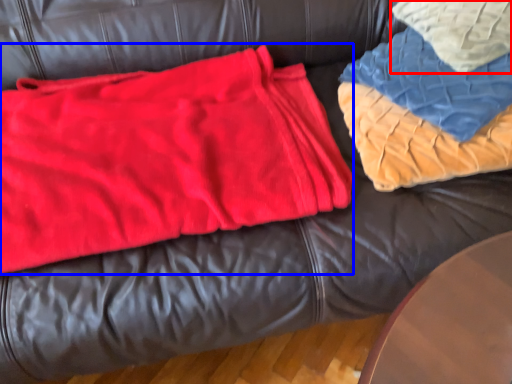
Question: Which point is closer to the camera, throw pillow (highlighted by a red box) or bean bag chair (highlighted by a blue box)?

Choices:
 (A) throw pillow
 (B) bean bag chair

Answer: (B)